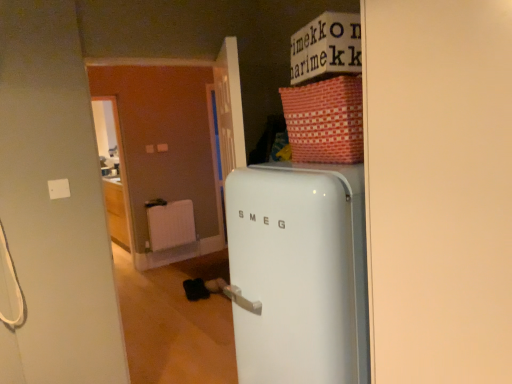
Question: Can you confirm if white glossy refrigerator at center is thinner than red woven basket at upper right?

Choices:
 (A) yes
 (B) no

Answer: (B)

Question: From the image's perspective, does white glossy refrigerator at center appear lower than red woven basket at upper right?

Choices:
 (A) yes
 (B) no

Answer: (A)

Question: From the image's perspective, is white glossy refrigerator at center on red woven basket at upper right?

Choices:
 (A) yes
 (B) no

Answer: (B)

Question: Is white glossy refrigerator at center to the right of red woven basket at upper right from the viewer's perspective?

Choices:
 (A) yes
 (B) no

Answer: (A)

Question: Is white glossy refrigerator at center taller than red woven basket at upper right?

Choices:
 (A) yes
 (B) no

Answer: (A)

Question: Does white glossy refrigerator at center come in front of red woven basket at upper right?

Choices:
 (A) yes
 (B) no

Answer: (A)

Question: Is there a large distance between red woven basket at upper right and white matte radiator at center?

Choices:
 (A) no
 (B) yes

Answer: (B)

Question: Is red woven basket at upper right located outside white matte radiator at center?

Choices:
 (A) no
 (B) yes

Answer: (B)

Question: Does red woven basket at upper right have a greater width compared to white matte radiator at center?

Choices:
 (A) no
 (B) yes

Answer: (B)

Question: Is red woven basket at upper right positioned before white matte radiator at center?

Choices:
 (A) yes
 (B) no

Answer: (A)

Question: Considering the relative positions of red woven basket at upper right and white matte radiator at center in the image provided, is red woven basket at upper right to the left of white matte radiator at center from the viewer's perspective?

Choices:
 (A) no
 (B) yes

Answer: (A)

Question: Considering the relative sizes of red woven basket at upper right and white matte radiator at center in the image provided, is red woven basket at upper right smaller than white matte radiator at center?

Choices:
 (A) no
 (B) yes

Answer: (A)

Question: Is white matte radiator at center closer to camera compared to red woven basket at upper right?

Choices:
 (A) yes
 (B) no

Answer: (B)